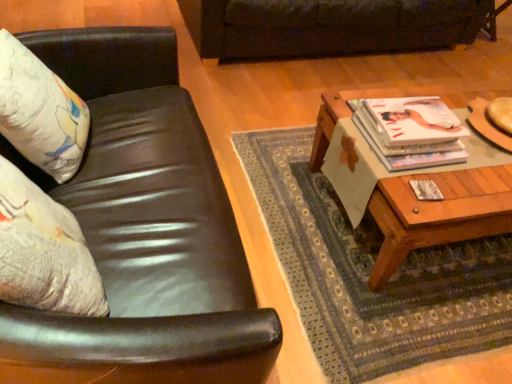
Question: In terms of width, does matte white pillow at left look wider or thinner when compared to white glossy magazine at upper right?

Choices:
 (A) wide
 (B) thin

Answer: (B)

Question: Which is correct: matte white pillow at left is inside white glossy magazine at upper right, or outside of it?

Choices:
 (A) outside
 (B) inside

Answer: (A)

Question: Which of these objects is positioned closest to the white glossy magazine at upper right?

Choices:
 (A) woodenwoodencoffee table at right
 (B) leather couch at upper center, which appears as the second studio couch when ordered from the bottom
 (C) matte white pillow at left
 (D) black leather couch at left, acting as the 1th studio couch starting from the front

Answer: (A)

Question: Which object is positioned farthest from the woodenwoodencoffee table at right?

Choices:
 (A) black leather couch at left, which appears as the 1th studio couch when ordered from the bottom
 (B) white glossy magazine at upper right
 (C) matte white pillow at left
 (D) leather couch at upper center, which appears as the second studio couch when viewed from the front

Answer: (D)